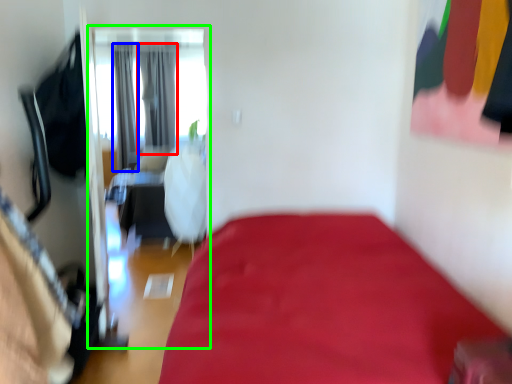
Question: Considering the real-world distances, which object is closest to curtain (highlighted by a red box)? curtain (highlighted by a blue box) or screen door (highlighted by a green box).

Choices:
 (A) curtain
 (B) screen door

Answer: (B)